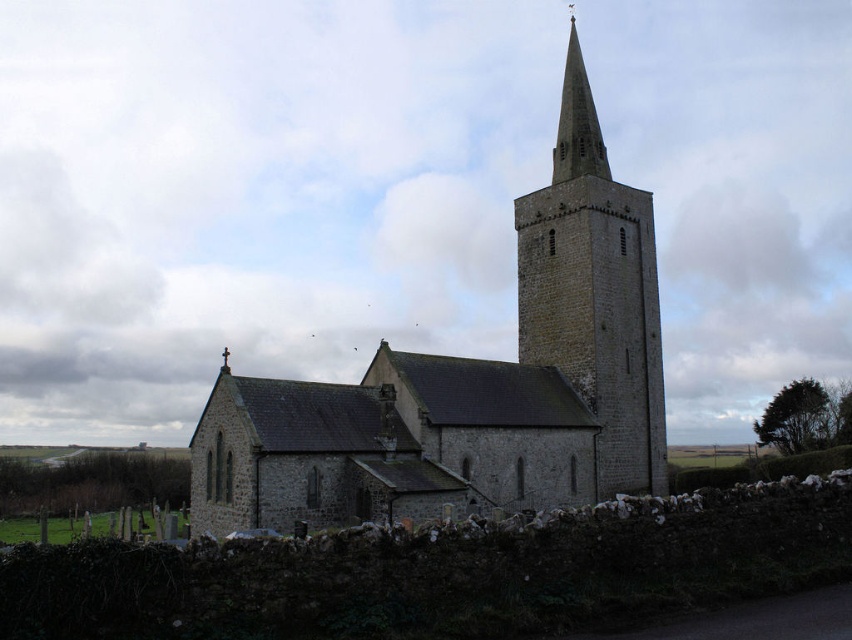
Is the position of stone church at center more distant than that of smooth stone spire at upper center?

No, it is in front of smooth stone spire at upper center.

Who is lower down, stone church at center or smooth stone spire at upper center?

stone church at center is lower down.

The image size is (852, 640). I want to click on stone church at center, so click(x=465, y=397).

Can you confirm if stone steeple at center is positioned below smooth stone spire at upper center?

Correct, stone steeple at center is located below smooth stone spire at upper center.

Who is positioned more to the right, stone steeple at center or smooth stone spire at upper center?

Positioned to the right is smooth stone spire at upper center.

You are a GUI agent. You are given a task and a screenshot of the screen. Output one action in this format:
    pyautogui.click(x=<x>, y=<y>)
    Task: Click on the stone steeple at center
    
    Given the screenshot: What is the action you would take?
    pyautogui.click(x=594, y=292)

Which is more to the left, stone church at center or stone steeple at center?

stone church at center is more to the left.

Is stone church at center below stone steeple at center?

Indeed, stone church at center is positioned under stone steeple at center.

Describe the element at coordinates (465, 397) in the screenshot. The height and width of the screenshot is (640, 852). I see `stone church at center` at that location.

The width and height of the screenshot is (852, 640). I want to click on stone church at center, so click(x=465, y=397).